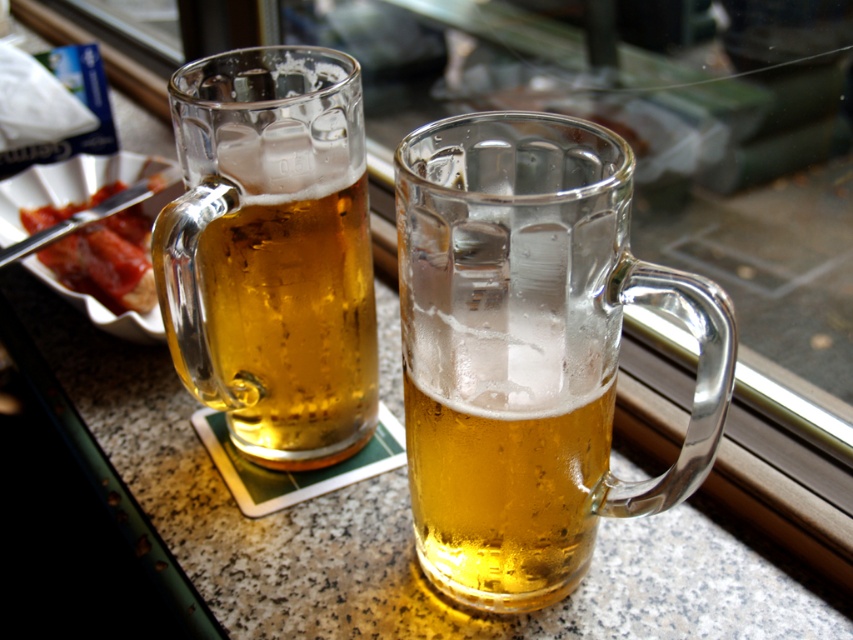
Can you confirm if translucent glass mug at center is wider than translucent glass mug at left?

Indeed, translucent glass mug at center has a greater width compared to translucent glass mug at left.

Measure the distance between translucent glass mug at center and translucent glass mug at left.

They are 6.26 inches apart.

Locate an element on the screen. This screenshot has width=853, height=640. translucent glass mug at center is located at coordinates (529, 349).

Where is `translucent glass mug at center`? The height and width of the screenshot is (640, 853). translucent glass mug at center is located at coordinates (529, 349).

Does translucent glass mug at left have a smaller size compared to slightly browned bread at left?

No.

Is point (299, 140) in front of point (45, 216)?

Yes, it is in front of point (45, 216).

At what (x,y) coordinates should I click in order to perform the action: click on translucent glass mug at left. Please return your answer as a coordinate pair (x, y). Looking at the image, I should click on (271, 252).

Can you confirm if translucent glass mug at center is wider than slightly browned bread at left?

Incorrect, translucent glass mug at center's width does not surpass slightly browned bread at left's.

Locate an element on the screen. Image resolution: width=853 pixels, height=640 pixels. translucent glass mug at center is located at coordinates (529, 349).

Find the location of a particular element. The width and height of the screenshot is (853, 640). translucent glass mug at center is located at coordinates (529, 349).